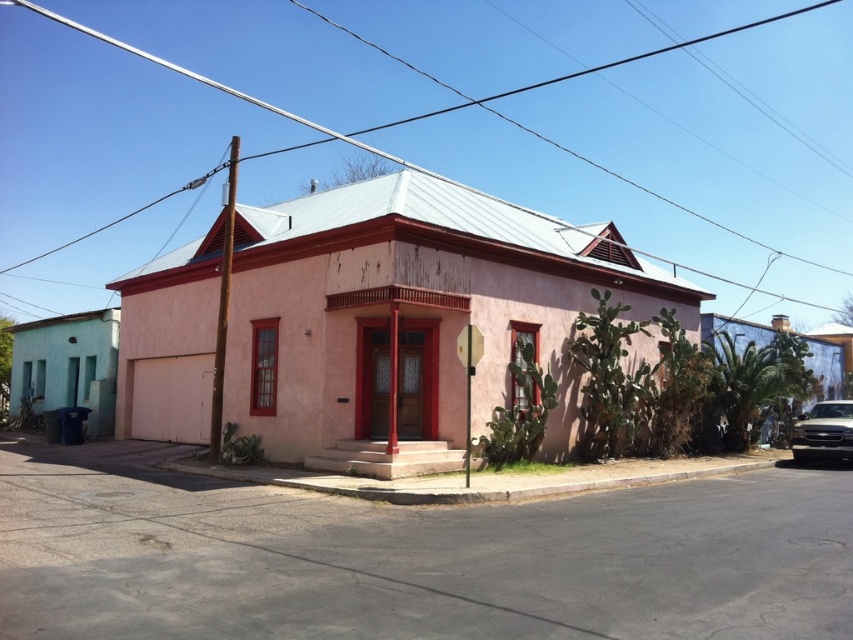
You are a delivery person approaching the house and need to park the gold metallic car at lower right. Is the gray concrete curb at lower center a suitable parking spot for the car?

The gray concrete curb at lower center is positioned under the gold metallic car at lower right, which suggests that the car is already parked there. Therefore, it is a suitable parking spot for the gold metallic car at lower right.

You are a delivery person trying to park your gold metallic car at lower right near the gray concrete curb at lower center. Can you park the car so that it is directly in front of the curb?

The gray concrete curb at lower center is to the left of the gold metallic car at lower right, so you can park the gold metallic car at lower right directly in front of the gray concrete curb at lower center by aligning it to its left side.